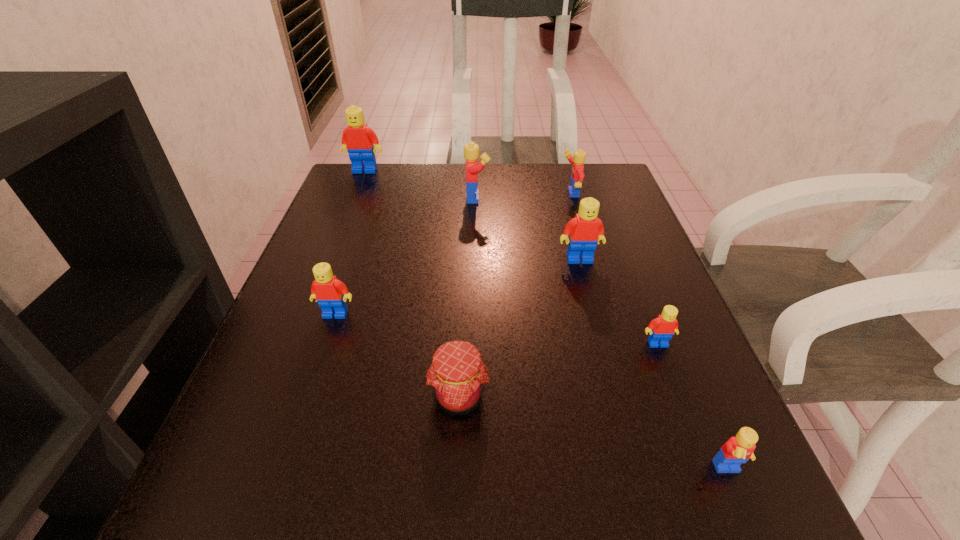
Locate an element on the screen. The image size is (960, 540). the farthest red Lego is located at coordinates (358, 139).

Identify the location of the tallest object. This screenshot has height=540, width=960. (358, 139).

You are a GUI agent. You are given a task and a screenshot of the screen. Output one action in this format:
    pyautogui.click(x=<x>, y=<y>)
    Task: Click on the biggest yellow Lego
    
    Given the screenshot: What is the action you would take?
    pyautogui.click(x=471, y=150)

The image size is (960, 540). What are the coordinates of `the third Lego from left to right` in the screenshot? It's located at (471, 150).

You are a GUI agent. You are given a task and a screenshot of the screen. Output one action in this format:
    pyautogui.click(x=<x>, y=<y>)
    Task: Click on the second biggest red Lego
    
    Given the screenshot: What is the action you would take?
    pyautogui.click(x=585, y=230)

The width and height of the screenshot is (960, 540). Identify the location of the second red Lego from right to left. coord(585,230).

The image size is (960, 540). I want to click on the second yellow Lego from left to right, so click(577, 175).

Identify the location of the third farthest red Lego. 331,294.

The image size is (960, 540). I want to click on the fourth nearest object, so click(x=331, y=294).

Find the location of `the seventh farthest object`. the seventh farthest object is located at coordinates click(x=457, y=375).